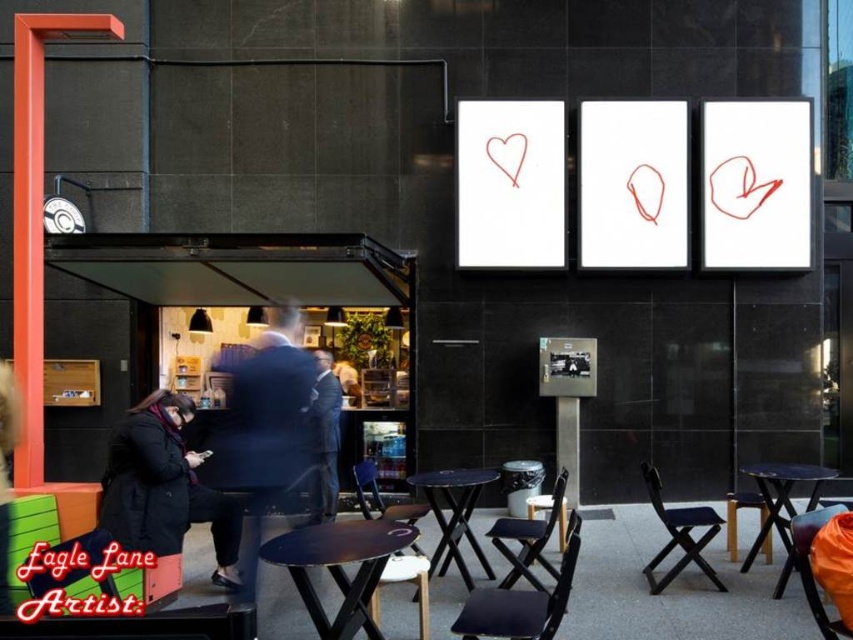
Does black glossy table at center come in front of black plastic table at lower right?

That is True.

Does black glossy table at center have a greater height compared to black plastic table at lower right?

No.

Between point (325, 636) and point (811, 492), which one is positioned in front?

Positioned in front is point (325, 636).

At what (x,y) coordinates should I click in order to perform the action: click on black glossy table at center. Please return your answer as a coordinate pair (x, y). Image resolution: width=853 pixels, height=640 pixels. Looking at the image, I should click on (339, 566).

Does black matte table at center appear on the left side of black plastic table at lower right?

Indeed, black matte table at center is positioned on the left side of black plastic table at lower right.

Does black matte table at center lie behind black plastic table at lower right?

Yes, it is.

Identify the location of black matte table at center. The height and width of the screenshot is (640, 853). (454, 515).

Is orange fabric chair at lower right below black plastic chair at center?

Actually, orange fabric chair at lower right is above black plastic chair at center.

Is orange fabric chair at lower right wider than black plastic chair at center?

Incorrect, orange fabric chair at lower right's width does not surpass black plastic chair at center's.

Who is more distant from viewer, (x=804, y=588) or (x=419, y=554)?

Point (x=419, y=554)

Find the location of a particular element. The height and width of the screenshot is (640, 853). orange fabric chair at lower right is located at coordinates (811, 566).